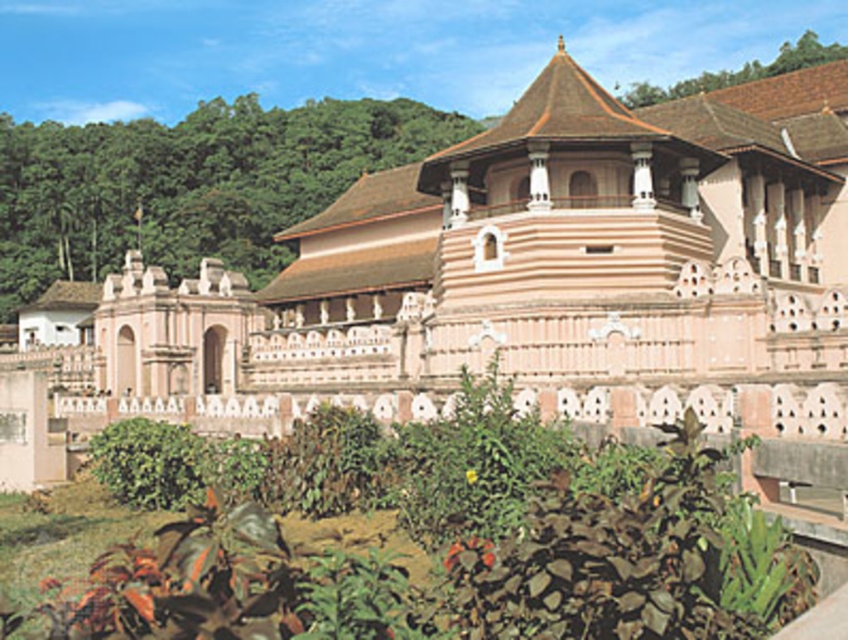
Locate an element on the screen. The height and width of the screenshot is (640, 848). pink stone palace at center is located at coordinates (512, 280).

Is pink stone palace at center to the left of green leafy shrub at left from the viewer's perspective?

Incorrect, pink stone palace at center is not on the left side of green leafy shrub at left.

Is point (339, 220) farther from camera compared to point (230, 202)?

No.

This screenshot has width=848, height=640. I want to click on pink stone palace at center, so click(512, 280).

Who is shorter, green leafy plants at center or green leafy shrub at left?

green leafy plants at center

Can you confirm if green leafy plants at center is taller than green leafy shrub at left?

No, green leafy plants at center is not taller than green leafy shrub at left.

Between point (626, 493) and point (321, 193), which one is positioned in front?

Point (626, 493)

This screenshot has width=848, height=640. I want to click on green leafy plants at center, so click(x=467, y=557).

Based on the photo, which of these two, pink stone palace at center or green leafy plants at center, stands shorter?

green leafy plants at center is shorter.

Is pink stone palace at center to the left of green leafy plants at center from the viewer's perspective?

Yes, pink stone palace at center is to the left of green leafy plants at center.

Is point (717, 163) behind point (550, 449)?

Yes, it is behind point (550, 449).

Where is `pink stone palace at center`? This screenshot has height=640, width=848. pink stone palace at center is located at coordinates (512, 280).